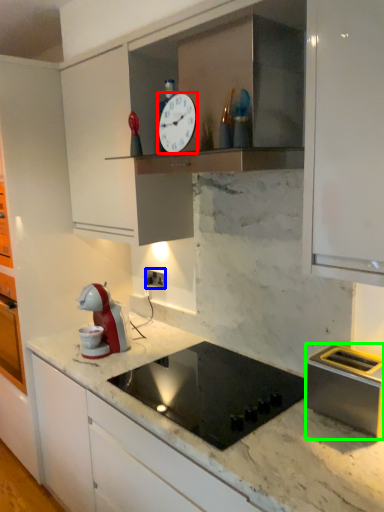
Question: Which is nearer to the clock (highlighted by a red box)? electric outlet (highlighted by a blue box) or kitchen appliance (highlighted by a green box).

Choices:
 (A) electric outlet
 (B) kitchen appliance

Answer: (B)